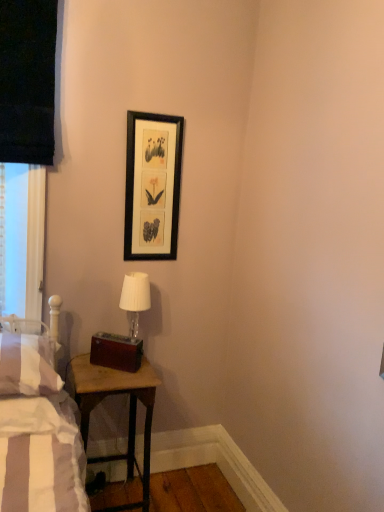
You are a GUI agent. You are given a task and a screenshot of the screen. Output one action in this format:
    pyautogui.click(x=<x>, y=<y>)
    Task: Click on the free point in front of white fabric lampshade at center
    
    Given the screenshot: What is the action you would take?
    pyautogui.click(x=120, y=375)